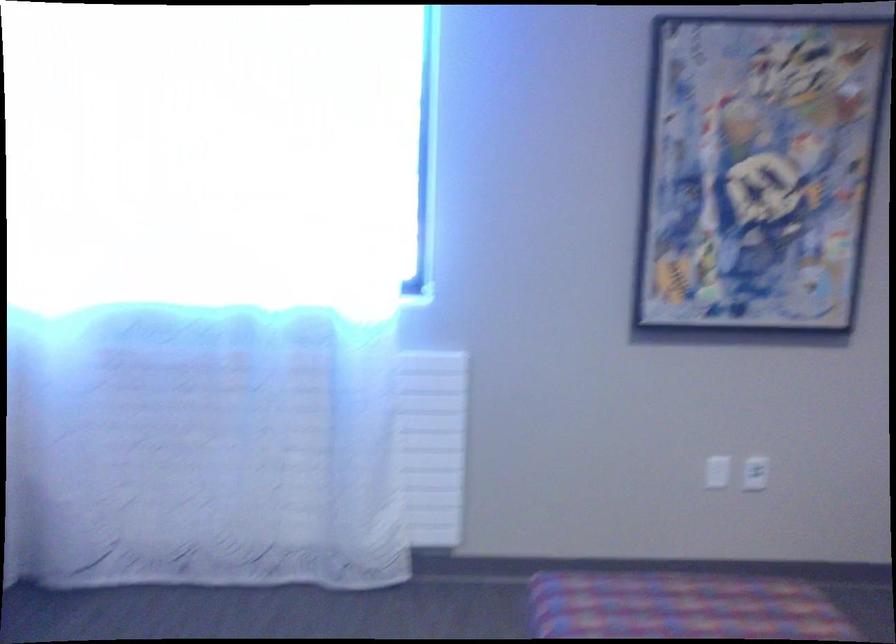
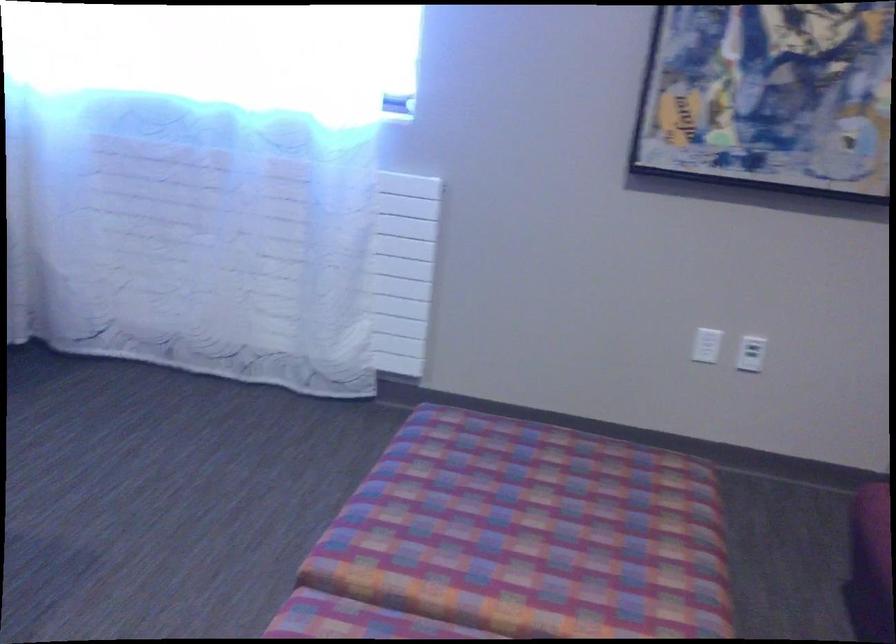
Question: In a continuous first-person perspective shot, in which direction is the camera moving?

Choices:
 (A) Left
 (B) Right
 (C) Forward
 (D) Backward

Answer: (B)